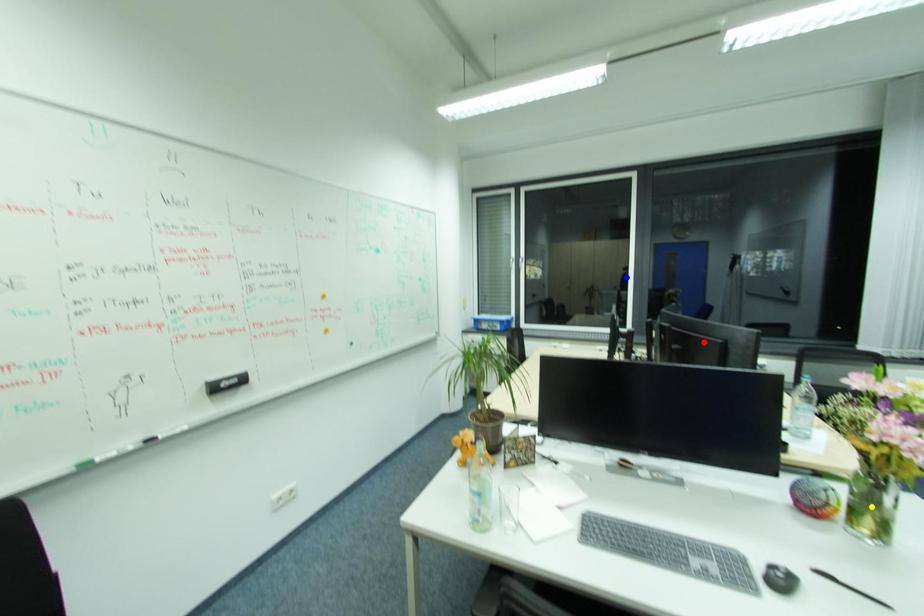
Order these from nearest to farthest:
1. blue point
2. red point
3. yellow point

yellow point, red point, blue point